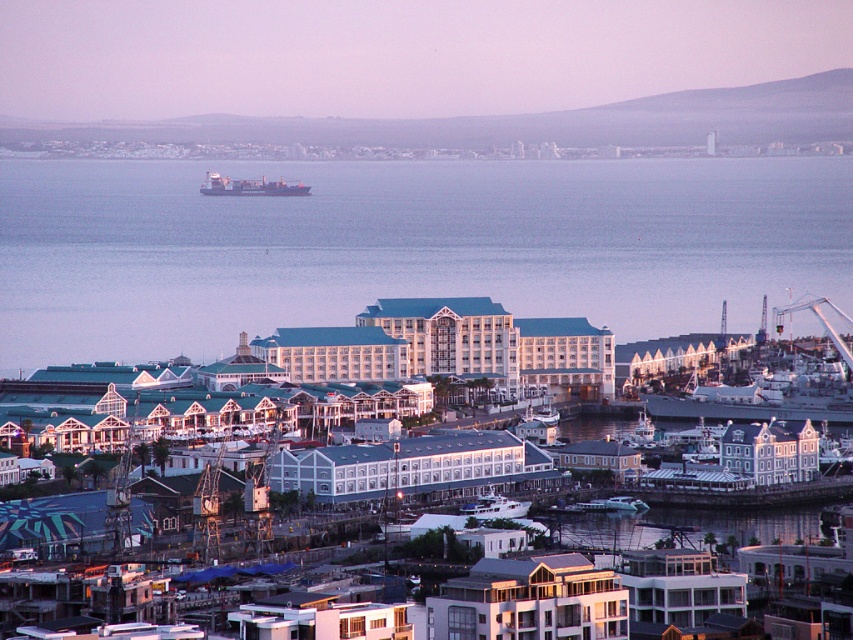
You are a drone operator tasked with capturing aerial footage of the coastal urban area. Your mission requires you to focus on the white glossy building at center. According to the coordinates provided, where exactly should you position your drone to capture the building in the center of your frame?

The white glossy building at center is located at coordinates point (529, 600), so position the drone there to center it in the frame.

You are a city planner assessing the coastal area. You need to determine if the white glossy building at center can be seen from the white glossy boat at center. Based on their relative heights, would the building obstruct the view from the boat?

The white glossy building at center is taller than the white glossy boat at center, so it would likely obstruct the view from the boat.